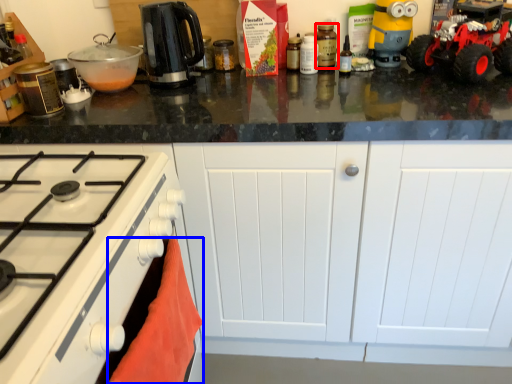
Question: Which object is further to the camera taking this photo, kitchen appliance (highlighted by a red box) or material (highlighted by a blue box)?

Choices:
 (A) kitchen appliance
 (B) material

Answer: (A)